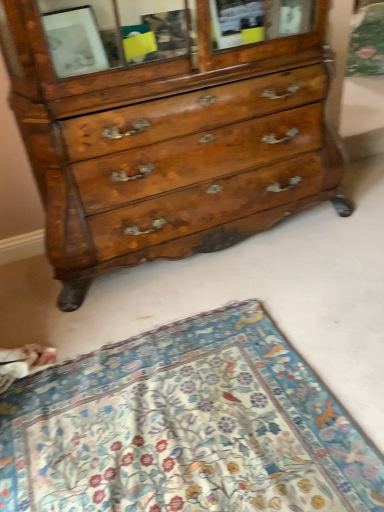
Question: In which direction should I rotate to look at shiny brown wood chest of drawers at center?

Choices:
 (A) right
 (B) left

Answer: (B)

Question: Is shiny brown wood chest of drawers at center at the right side of floral-patterned fabric at lower center?

Choices:
 (A) no
 (B) yes

Answer: (B)

Question: From a real-world perspective, is shiny brown wood chest of drawers at center located higher than floral-patterned fabric at lower center?

Choices:
 (A) no
 (B) yes

Answer: (B)

Question: Can you confirm if shiny brown wood chest of drawers at center is shorter than floral-patterned fabric at lower center?

Choices:
 (A) yes
 (B) no

Answer: (B)

Question: Is shiny brown wood chest of drawers at center bigger than floral-patterned fabric at lower center?

Choices:
 (A) yes
 (B) no

Answer: (A)

Question: Is shiny brown wood chest of drawers at center turned away from floral-patterned fabric at lower center?

Choices:
 (A) yes
 (B) no

Answer: (B)

Question: Is shiny brown wood chest of drawers at center surrounding floral-patterned fabric at lower center?

Choices:
 (A) yes
 (B) no

Answer: (B)

Question: Is floral-patterned fabric at lower center positioned far away from shiny brown wood chest of drawers at center?

Choices:
 (A) no
 (B) yes

Answer: (A)

Question: From a real-world perspective, does floral-patterned fabric at lower center stand above shiny brown wood chest of drawers at center?

Choices:
 (A) no
 (B) yes

Answer: (A)

Question: From a real-world perspective, is floral-patterned fabric at lower center positioned under shiny brown wood chest of drawers at center based on gravity?

Choices:
 (A) yes
 (B) no

Answer: (A)

Question: From the image's perspective, is floral-patterned fabric at lower center located beneath shiny brown wood chest of drawers at center?

Choices:
 (A) no
 (B) yes

Answer: (B)

Question: From the image's perspective, is floral-patterned fabric at lower center located above shiny brown wood chest of drawers at center?

Choices:
 (A) no
 (B) yes

Answer: (A)

Question: Is floral-patterned fabric at lower center shorter than shiny brown wood chest of drawers at center?

Choices:
 (A) no
 (B) yes

Answer: (B)

Question: Is floral-patterned fabric at lower center bigger or smaller than shiny brown wood chest of drawers at center?

Choices:
 (A) small
 (B) big

Answer: (A)